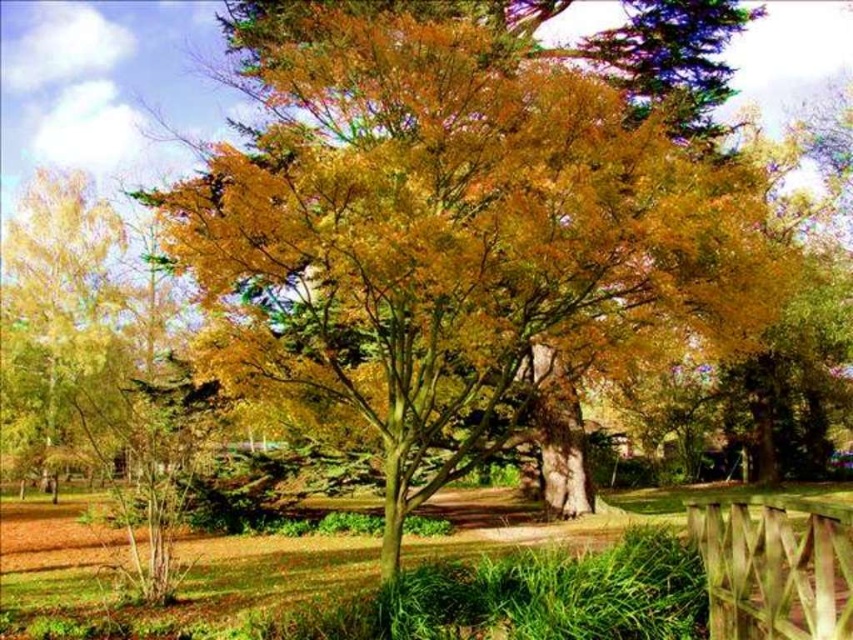
Consider the image. You are standing in the park and see the golden yellow leaves at left and the wooden fence at lower right. Which object is higher from the ground?

The golden yellow leaves at left are higher from the ground than the wooden fence at lower right because they are positioned above it.